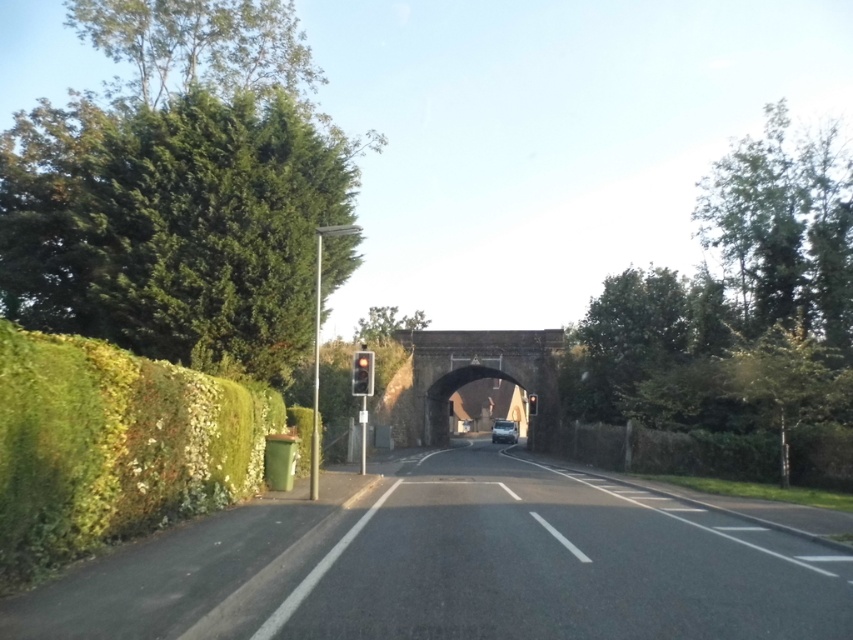
Does green leafy tree at left lie behind green leafy tree at center?

No, it is not.

Image resolution: width=853 pixels, height=640 pixels. Describe the element at coordinates (178, 188) in the screenshot. I see `green leafy tree at left` at that location.

Who is more distant from viewer, (189, 182) or (392, 324)?

The point (392, 324) is behind.

At what (x,y) coordinates should I click in order to perform the action: click on green leafy tree at left. Please return your answer as a coordinate pair (x, y). The height and width of the screenshot is (640, 853). Looking at the image, I should click on (178, 188).

Who is positioned more to the left, green leafy tree at left or metallic silver van at center?

From the viewer's perspective, green leafy tree at left appears more on the left side.

Which is more to the right, green leafy tree at left or metallic silver van at center?

metallic silver van at center is more to the right.

Does point (271, 44) come behind point (492, 438)?

That is False.

You are a GUI agent. You are given a task and a screenshot of the screen. Output one action in this format:
    pyautogui.click(x=<x>, y=<y>)
    Task: Click on the green leafy tree at left
    This screenshot has width=853, height=640.
    Given the screenshot: What is the action you would take?
    pyautogui.click(x=178, y=188)

Is asphalt road at center taller than green leafy hedge at left?

Yes, asphalt road at center is taller than green leafy hedge at left.

Does asphalt road at center appear under green leafy hedge at left?

Yes, asphalt road at center is below green leafy hedge at left.

Is point (273, 554) in front of point (90, 397)?

No.

Identify the location of asphalt road at center. This screenshot has width=853, height=640. (454, 566).